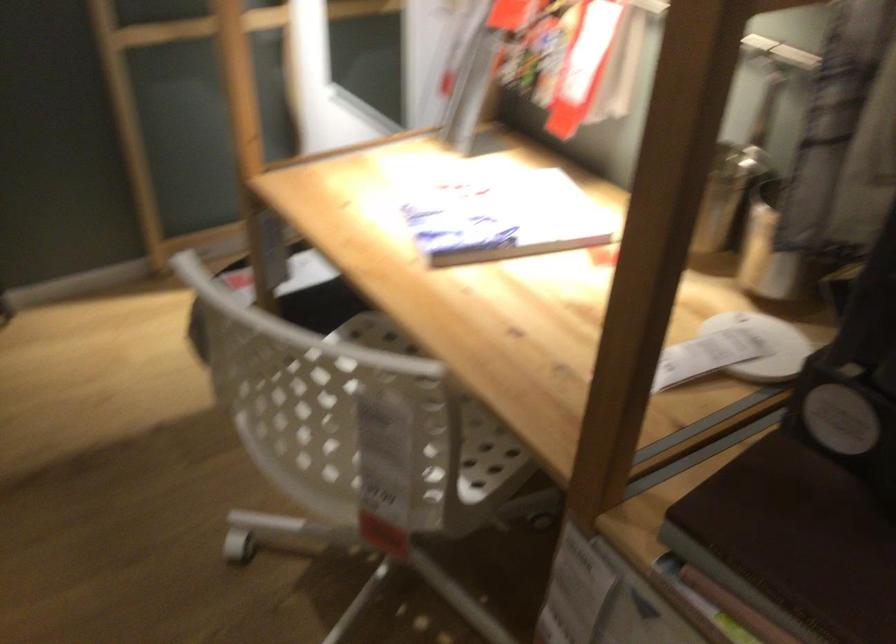
The height and width of the screenshot is (644, 896). What are the coordinates of `metal shaker cup` in the screenshot? It's located at (771, 252).